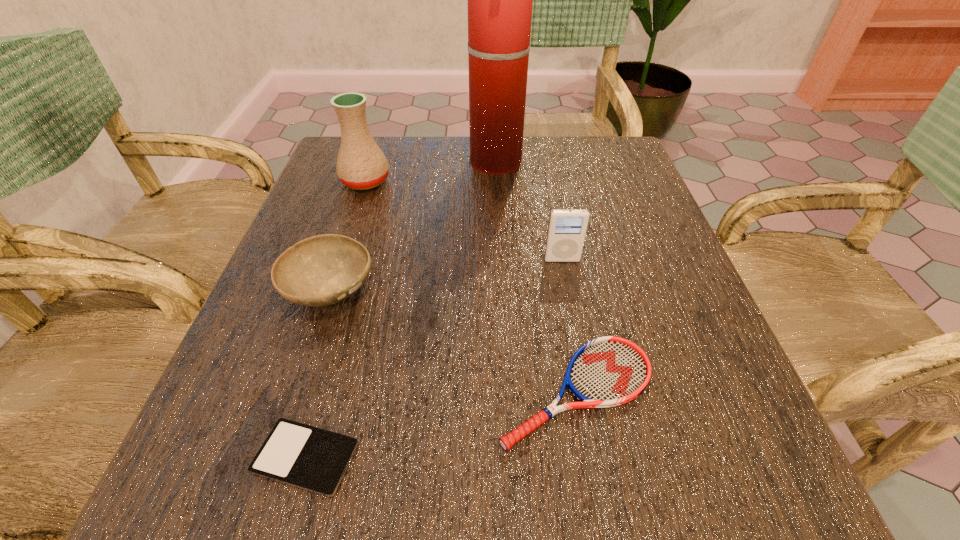
Find the location of a particular element. pottery positioned at the left edge is located at coordinates (361, 165).

This screenshot has width=960, height=540. What are the coordinates of `bowl situated at the left edge` in the screenshot? It's located at tap(322, 270).

At what (x,y) coordinates should I click in order to perform the action: click on iPod located in the left edge section of the desktop. Please return your answer as a coordinate pair (x, y). Image resolution: width=960 pixels, height=540 pixels. Looking at the image, I should click on (306, 457).

The height and width of the screenshot is (540, 960). I want to click on object located in the right edge section of the desktop, so click(x=608, y=371).

You are a GUI agent. You are given a task and a screenshot of the screen. Output one action in this format:
    pyautogui.click(x=<x>, y=<y>)
    Task: Click on the object that is at the far left corner
    The image size is (960, 540).
    Given the screenshot: What is the action you would take?
    pyautogui.click(x=361, y=165)

Find the location of `object present at the near left corner`. object present at the near left corner is located at coordinates pyautogui.click(x=306, y=457).

The height and width of the screenshot is (540, 960). In order to click on object located in the near right corner section of the desktop in this screenshot , I will do `click(608, 371)`.

Locate an element on the screen. The width and height of the screenshot is (960, 540). free space at the far edge of the desktop is located at coordinates (565, 183).

This screenshot has height=540, width=960. What are the coordinates of `vacant space at the near edge of the desktop` in the screenshot? It's located at (518, 455).

Where is `free space at the left edge of the desktop`? The height and width of the screenshot is (540, 960). free space at the left edge of the desktop is located at coordinates (262, 401).